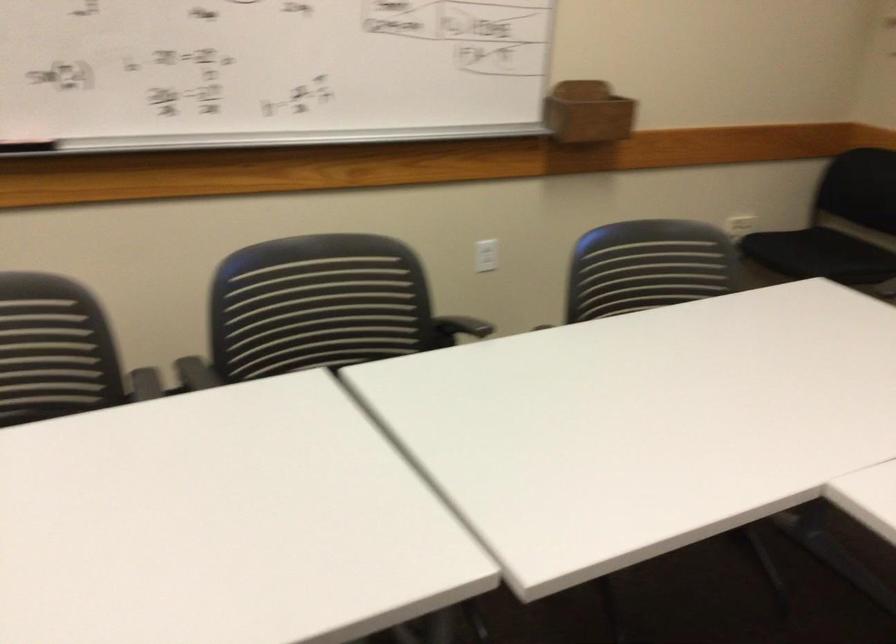
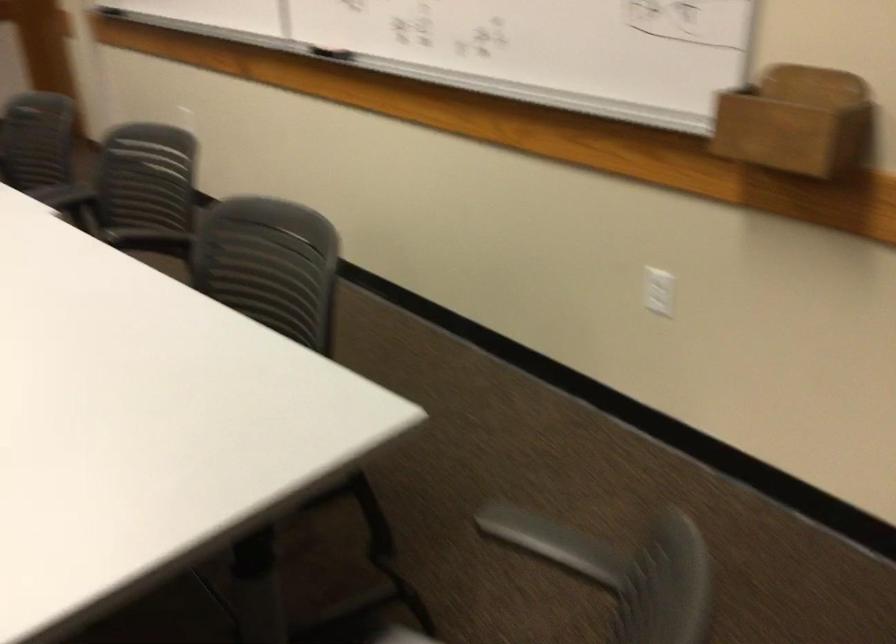
The point at (252, 317) is marked in the first image. Where is the corresponding point in the second image?

(144, 178)